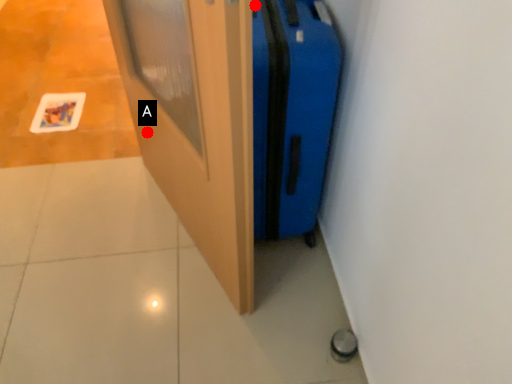
Question: Two points are circled on the image, labeled by A and B beside each circle. Which of the following is the closest to the observer?

Choices:
 (A) A is closer
 (B) B is closer

Answer: (B)